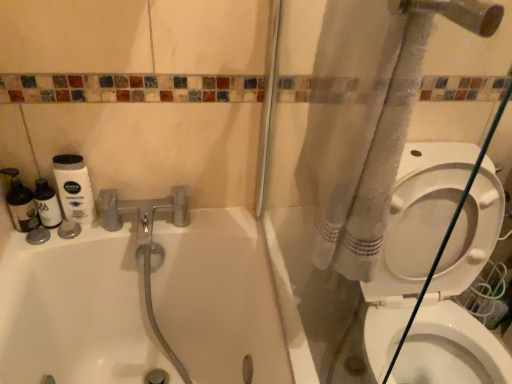
Question: From a real-world perspective, is white fabric shower curtain at right over white glossy bathtub at upper left?

Choices:
 (A) yes
 (B) no

Answer: (A)

Question: Is white fabric shower curtain at right to the left of white glossy bathtub at upper left from the viewer's perspective?

Choices:
 (A) no
 (B) yes

Answer: (A)

Question: Is white fabric shower curtain at right next to white glossy bathtub at upper left?

Choices:
 (A) no
 (B) yes

Answer: (A)

Question: Is white fabric shower curtain at right closer to the viewer compared to white glossy bathtub at upper left?

Choices:
 (A) yes
 (B) no

Answer: (B)

Question: Considering the relative sizes of white fabric shower curtain at right and white glossy bathtub at upper left in the image provided, is white fabric shower curtain at right bigger than white glossy bathtub at upper left?

Choices:
 (A) yes
 (B) no

Answer: (B)

Question: Which is correct: white glossy bathtub at upper left is inside white fabric shower curtain at right, or outside of it?

Choices:
 (A) outside
 (B) inside

Answer: (A)

Question: Looking at their shapes, would you say white glossy bathtub at upper left is wider or thinner than white fabric shower curtain at right?

Choices:
 (A) wide
 (B) thin

Answer: (A)

Question: Does point (245, 236) appear closer or farther from the camera than point (332, 13)?

Choices:
 (A) closer
 (B) farther

Answer: (B)

Question: Based on their positions, is white glossy bathtub at upper left located to the left or right of white fabric shower curtain at right?

Choices:
 (A) right
 (B) left

Answer: (B)

Question: Would you say white glossy bathtub at upper left is to the left or to the right of white glossy bidet at lower right in the picture?

Choices:
 (A) right
 (B) left

Answer: (B)

Question: Is white glossy bathtub at upper left spatially inside white glossy bidet at lower right, or outside of it?

Choices:
 (A) outside
 (B) inside

Answer: (A)

Question: From a real-world perspective, relative to white glossy bidet at lower right, is white glossy bathtub at upper left vertically above or below?

Choices:
 (A) below
 (B) above

Answer: (B)

Question: Looking at their shapes, would you say white glossy bathtub at upper left is wider or thinner than white glossy bidet at lower right?

Choices:
 (A) thin
 (B) wide

Answer: (B)

Question: Is white glossy bidet at lower right in front of or behind white fabric shower curtain at right in the image?

Choices:
 (A) behind
 (B) front

Answer: (A)

Question: From the image's perspective, is white glossy bidet at lower right above or below white fabric shower curtain at right?

Choices:
 (A) below
 (B) above

Answer: (A)